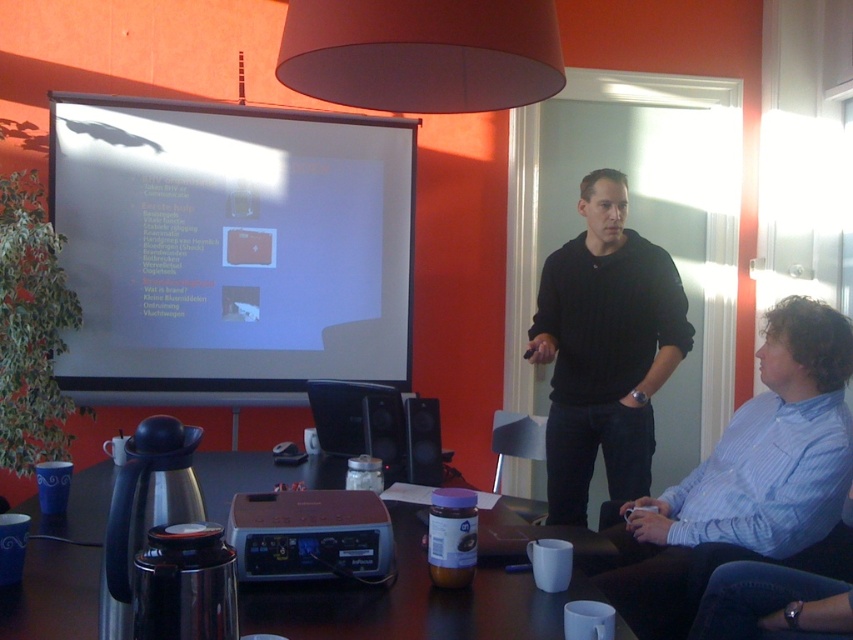
Based on the photo, you are organizing a presentation and need to place a laptop on the dark wood table at center. However, there is a black cotton hoodie at center in the way. Can you place the laptop there without moving the hoodie?

The dark wood table at center is positioned under the black cotton hoodie at center, meaning the hoodie is hanging over the table. Therefore, you can place the laptop on the table without moving the hoodie as it is hanging above it.

You are organizing a presentation and need to ensure there is enough space between the white matte projection screen at upper left and the blue striped shirt at lower right for attendees to walk comfortably. The recommended minimum distance for a walking path is 1.5 meters. Is the current spacing sufficient?

The white matte projection screen at upper left and blue striped shirt at lower right are 1.92 meters apart, which exceeds the recommended minimum distance of 1.5 meters. Therefore, the current spacing is sufficient for attendees to walk comfortably.

In the scene shown: You are organizing a presentation and need to decide where to place a new poster. The poster is wider than the blue striped shirt at lower right. Based on the scene, can the poster fit on the white matte projection screen at upper left?

The white matte projection screen at upper left is wider than the blue striped shirt at lower right. Since the poster is wider than the blue striped shirt at lower right, it might fit on the screen if the screen is wide enough. However, without knowing the exact width of the poster, we cannot be certain. But since the screen is wider than the shirt, and the poster is also wider than the shirt, there is a possibility it could fit, depending on the poster dimensions.